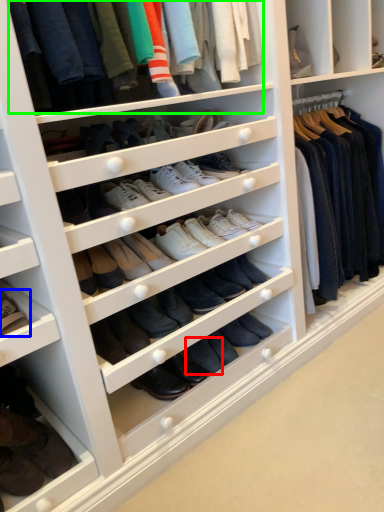
Question: Considering the real-world distances, which object is closest to shoe (highlighted by a red box)? footwear (highlighted by a blue box) or clothing (highlighted by a green box).

Choices:
 (A) footwear
 (B) clothing

Answer: (A)